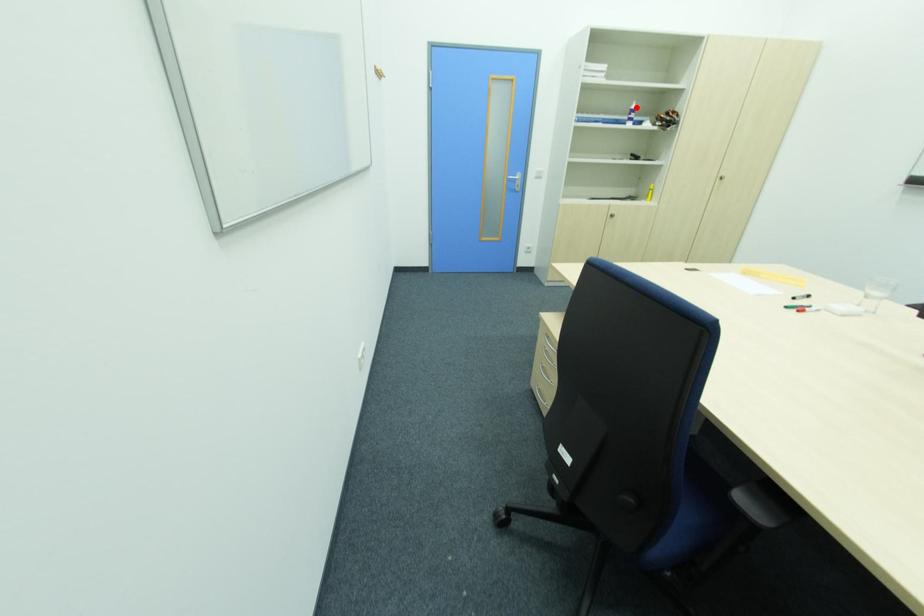
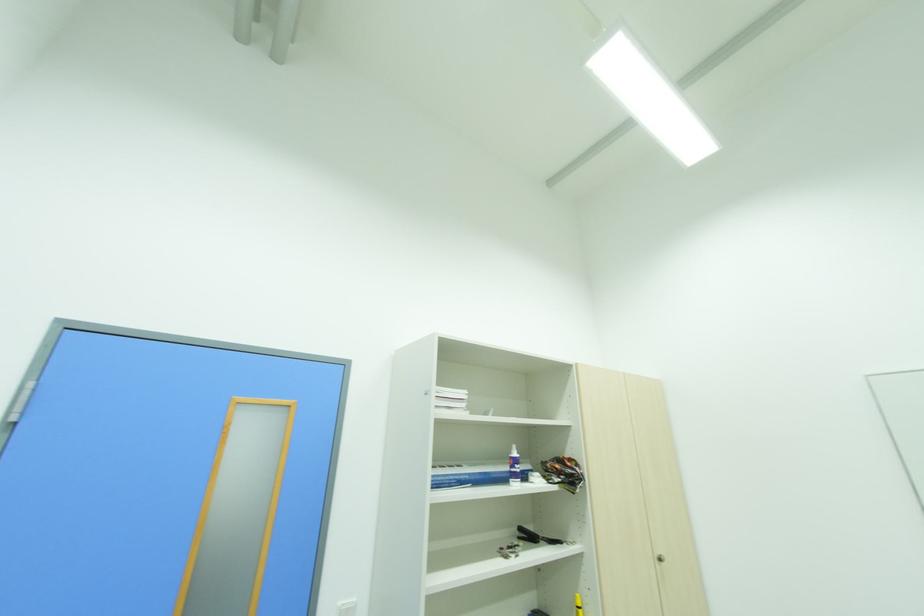
Where in the second image is the point corresponding to the highlighted location from the first image?

(517, 455)